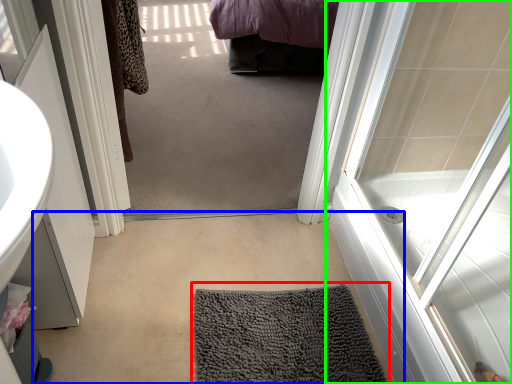
Question: Considering the real-world distances, which object is farthest from bath mat (highlighted by a red box)? plain (highlighted by a blue box) or door (highlighted by a green box)?

Choices:
 (A) plain
 (B) door

Answer: (B)